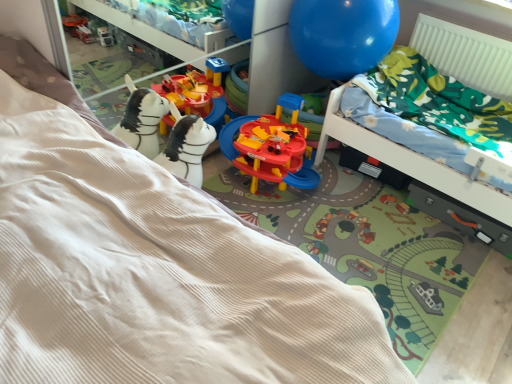
Where is `dark gray plastic drawer at lower right`? The width and height of the screenshot is (512, 384). dark gray plastic drawer at lower right is located at coordinates (461, 217).

This screenshot has height=384, width=512. Describe the element at coordinates (342, 35) in the screenshot. I see `blue glossy balloon at upper right` at that location.

Where is `blue glossy balloon at upper right`? The height and width of the screenshot is (384, 512). blue glossy balloon at upper right is located at coordinates (342, 35).

What are the coordinates of `dark gray plastic drawer at lower right` in the screenshot? It's located at (461, 217).

From the image's perspective, relative to green floral fabric hospital bed at upper right, is blue glossy balloon at upper right above or below?

blue glossy balloon at upper right is above green floral fabric hospital bed at upper right.

Based on their sizes in the image, would you say blue glossy balloon at upper right is bigger or smaller than green floral fabric hospital bed at upper right?

Considering their sizes, blue glossy balloon at upper right takes up less space than green floral fabric hospital bed at upper right.

Is green floral fabric hospital bed at upper right at the back of blue glossy balloon at upper right?

That's not correct — blue glossy balloon at upper right is not looking away from green floral fabric hospital bed at upper right.

Is white ribbed radiator at upper right to the left of blue glossy balloon at upper right from the viewer's perspective?

In fact, white ribbed radiator at upper right is to the right of blue glossy balloon at upper right.

Is white ribbed radiator at upper right beside blue glossy balloon at upper right?

There is a gap between white ribbed radiator at upper right and blue glossy balloon at upper right.

Between point (442, 43) and point (294, 28), which one is positioned in front?

The point (294, 28) is closer to the camera.

Considering the relative sizes of white ribbed radiator at upper right and dark gray plastic drawer at lower right in the image provided, is white ribbed radiator at upper right shorter than dark gray plastic drawer at lower right?

Incorrect, the height of white ribbed radiator at upper right does not fall short of that of dark gray plastic drawer at lower right.

Is white ribbed radiator at upper right to the right of dark gray plastic drawer at lower right from the viewer's perspective?

Indeed, white ribbed radiator at upper right is positioned on the right side of dark gray plastic drawer at lower right.

Is white ribbed radiator at upper right inside the boundaries of dark gray plastic drawer at lower right, or outside?

white ribbed radiator at upper right is located beyond the bounds of dark gray plastic drawer at lower right.

Looking at this image, from the image's perspective, is white ribbed radiator at upper right located above or below dark gray plastic drawer at lower right?

Clearly, from the image's perspective, white ribbed radiator at upper right is above dark gray plastic drawer at lower right.

Between green floral fabric hospital bed at upper right and blue glossy balloon at upper right, which one is positioned behind?

blue glossy balloon at upper right is behind.

Is point (390, 110) positioned after point (396, 23)?

No.

I want to click on balloon behind the green floral fabric hospital bed at upper right, so click(342, 35).

Which is closer to the camera, (x=362, y=44) or (x=116, y=332)?

Clearly, point (x=362, y=44) is more distant from the camera than point (x=116, y=332).

How different are the orientations of blue glossy balloon at upper right and beige corduroy bed at lower left in degrees?

blue glossy balloon at upper right and beige corduroy bed at lower left are facing 90.7 degrees away from each other.

From a real-world perspective, is blue glossy balloon at upper right physically located above or below beige corduroy bed at lower left?

blue glossy balloon at upper right is situated higher than beige corduroy bed at lower left in the real world.

Does blue glossy balloon at upper right have a greater width compared to beige corduroy bed at lower left?

In fact, blue glossy balloon at upper right might be narrower than beige corduroy bed at lower left.

Can you tell me how much white ribbed radiator at upper right and beige corduroy bed at lower left differ in facing direction?

They differ by 89.7 degrees in their facing directions.

In the scene shown: Are white ribbed radiator at upper right and beige corduroy bed at lower left far apart?

Yes.

How far apart are white ribbed radiator at upper right and beige corduroy bed at lower left?

The distance of white ribbed radiator at upper right from beige corduroy bed at lower left is 6.70 feet.

From the image's perspective, is white ribbed radiator at upper right under beige corduroy bed at lower left?

No, from the image's perspective, white ribbed radiator at upper right is not beneath beige corduroy bed at lower left.

Is white ribbed radiator at upper right located outside green floral fabric hospital bed at upper right?

Yes, white ribbed radiator at upper right is not within green floral fabric hospital bed at upper right.

Does white ribbed radiator at upper right come in front of green floral fabric hospital bed at upper right?

No.

Is white ribbed radiator at upper right oriented away from green floral fabric hospital bed at upper right?

No, green floral fabric hospital bed at upper right is not at the back of white ribbed radiator at upper right.

At what (x,y) coordinates should I click in order to perform the action: click on balloon on the left of green floral fabric hospital bed at upper right. Please return your answer as a coordinate pair (x, y). The height and width of the screenshot is (384, 512). Looking at the image, I should click on (342, 35).

Locate an element on the screen. The height and width of the screenshot is (384, 512). radiator lying behind the blue glossy balloon at upper right is located at coordinates (x=465, y=53).

Which object lies nearer to the anchor point dark gray plastic drawer at lower right, green floral fabric hospital bed at upper right or blue glossy balloon at upper right?

Based on the image, green floral fabric hospital bed at upper right appears to be nearer to dark gray plastic drawer at lower right.

From the image, which object appears to be farther from blue glossy balloon at upper right, beige corduroy bed at lower left or green floral fabric hospital bed at upper right?

beige corduroy bed at lower left.

Estimate the real-world distances between objects in this image. Which object is further from white ribbed radiator at upper right, blue glossy balloon at upper right or dark gray plastic drawer at lower right?

dark gray plastic drawer at lower right is further to white ribbed radiator at upper right.

Which object lies nearer to the anchor point green floral fabric hospital bed at upper right, beige corduroy bed at lower left or white ribbed radiator at upper right?

Among the two, white ribbed radiator at upper right is located nearer to green floral fabric hospital bed at upper right.

Which object lies nearer to the anchor point blue glossy balloon at upper right, white ribbed radiator at upper right or green floral fabric hospital bed at upper right?

Among the two, green floral fabric hospital bed at upper right is located nearer to blue glossy balloon at upper right.

From the image, which object appears to be nearer to green floral fabric hospital bed at upper right, dark gray plastic drawer at lower right or beige corduroy bed at lower left?

dark gray plastic drawer at lower right.

When comparing their distances from green floral fabric hospital bed at upper right, does blue glossy balloon at upper right or dark gray plastic drawer at lower right seem further?

Among the two, blue glossy balloon at upper right is located further to green floral fabric hospital bed at upper right.

When comparing their distances from white ribbed radiator at upper right, does beige corduroy bed at lower left or dark gray plastic drawer at lower right seem further?

beige corduroy bed at lower left is positioned further to the anchor white ribbed radiator at upper right.

Locate an element on the screen. balloon located between beige corduroy bed at lower left and white ribbed radiator at upper right in the depth direction is located at coordinates (342, 35).

The image size is (512, 384). What are the coordinates of `hospital bed between white ribbed radiator at upper right and dark gray plastic drawer at lower right vertically` in the screenshot? It's located at (430, 98).

You are a GUI agent. You are given a task and a screenshot of the screen. Output one action in this format:
    pyautogui.click(x=<x>, y=<y>)
    Task: Click on the hospital bed between blue glossy balloon at upper right and dark gray plastic drawer at lower right vertically
    The height and width of the screenshot is (384, 512).
    Given the screenshot: What is the action you would take?
    pyautogui.click(x=430, y=98)

This screenshot has width=512, height=384. What are the coordinates of `drawer between beige corduroy bed at lower left and white ribbed radiator at upper right in the front-back direction` in the screenshot? It's located at (461, 217).